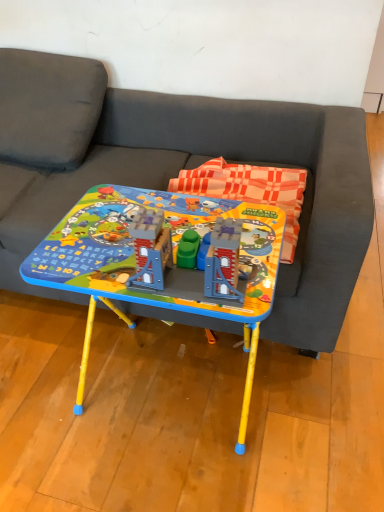
In order to click on vacant area that lies between matte plastic table at center and dark gray fabric couch at center in this screenshot , I will do `click(115, 368)`.